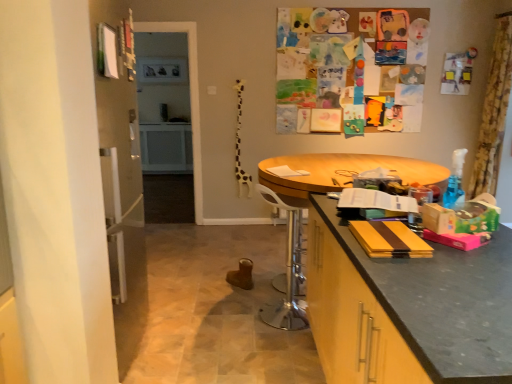
Question: From a real-world perspective, is yellow floral fabric curtain at upper right positioned above or below white plastic swivel chair at center?

Choices:
 (A) above
 (B) below

Answer: (A)

Question: Considering the positions of yellow floral fabric curtain at upper right and white plastic swivel chair at center in the image, is yellow floral fabric curtain at upper right wider or thinner than white plastic swivel chair at center?

Choices:
 (A) wide
 (B) thin

Answer: (B)

Question: Which object is positioned closest to the yellow floral fabric curtain at upper right?

Choices:
 (A) wooden round table at center
 (B) matte black countertop at right
 (C) white plastic swivel chair at center

Answer: (A)

Question: Based on their relative distances, which object is farther from the matte black countertop at right?

Choices:
 (A) yellow floral fabric curtain at upper right
 (B) white plastic swivel chair at center
 (C) wooden round table at center

Answer: (A)